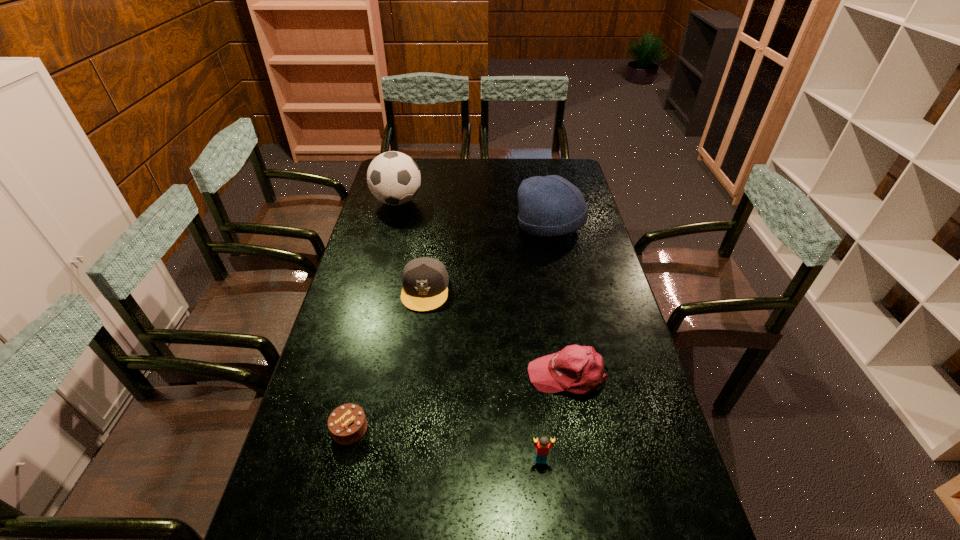
Locate which object ranks in proximity to the soccer ball. Please provide its 2D coordinates. Your answer should be formatted as a tuple, i.e. [(x, y)], where the tuple contains the x and y coordinates of a point satisfying the conditions above.

[(425, 280)]

Select which object is the closest to the chocolate cake. Please provide its 2D coordinates. Your answer should be formatted as a tuple, i.e. [(x, y)], where the tuple contains the x and y coordinates of a point satisfying the conditions above.

[(425, 280)]

In order to click on free space in the image that satisfies the following two spatial constraints: 1. at the front of the baseball cap with the brim; 2. on the face of the Lego in this screenshot , I will do `click(583, 460)`.